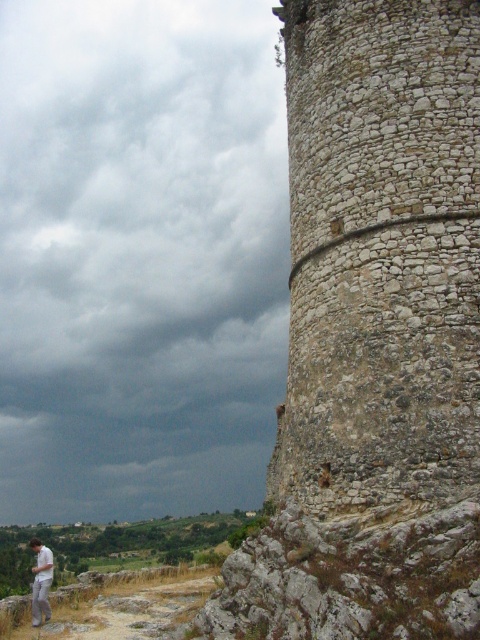
Question: Which object is closer to the camera taking this photo?

Choices:
 (A) white cotton shirt at lower left
 (B) rough stone tower at right

Answer: (B)

Question: Can you confirm if dark gray cloud at upper left is smaller than white cotton shirt at lower left?

Choices:
 (A) no
 (B) yes

Answer: (A)

Question: Which point appears closest to the camera in this image?

Choices:
 (A) (38, 561)
 (B) (78, 465)

Answer: (A)

Question: Is dark gray cloud at upper left positioned in front of white cotton shirt at lower left?

Choices:
 (A) yes
 (B) no

Answer: (B)

Question: Where is dark gray cloud at upper left located in relation to rough stone tower at right in the image?

Choices:
 (A) above
 (B) below

Answer: (A)

Question: Estimate the real-world distances between objects in this image. Which object is farther from the white cotton shirt at lower left?

Choices:
 (A) dark gray cloud at upper left
 (B) rough stone tower at right

Answer: (A)